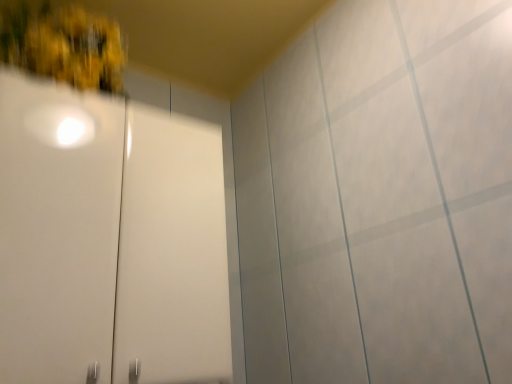
Question: Should I look upward or downward to see white glossy cabinet at upper left?

Choices:
 (A) down
 (B) up

Answer: (A)